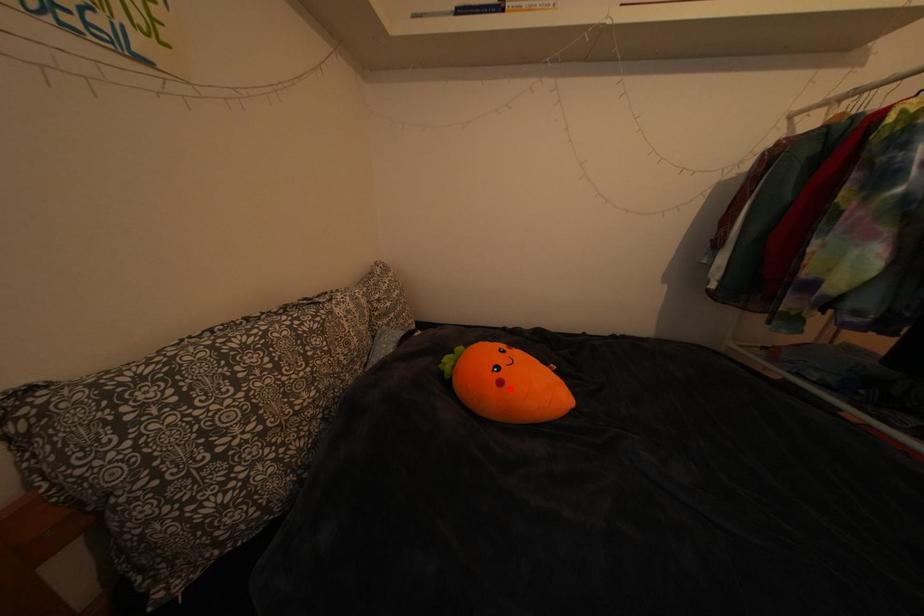
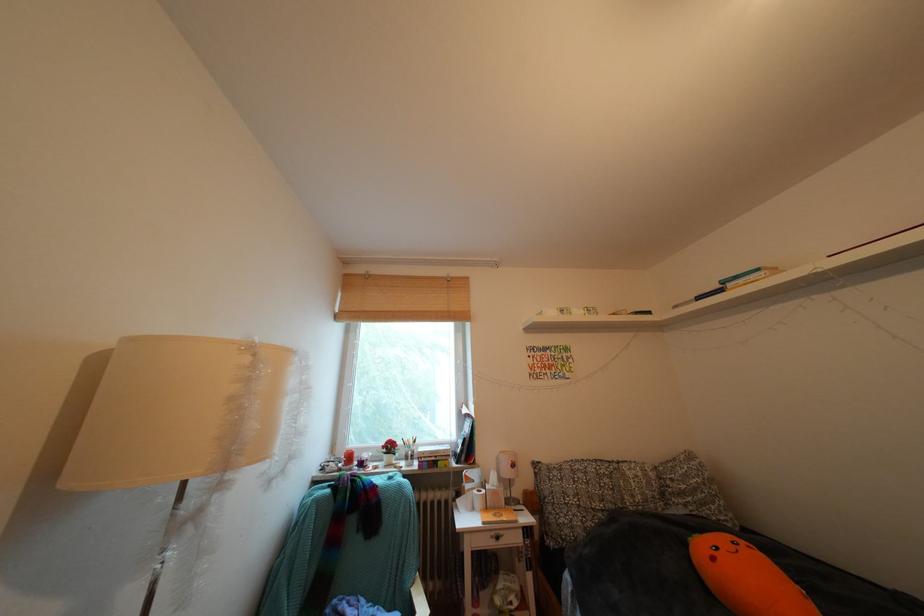
The point at the highlighted location is marked in the first image. Where is the corresponding point in the second image?

(723, 564)